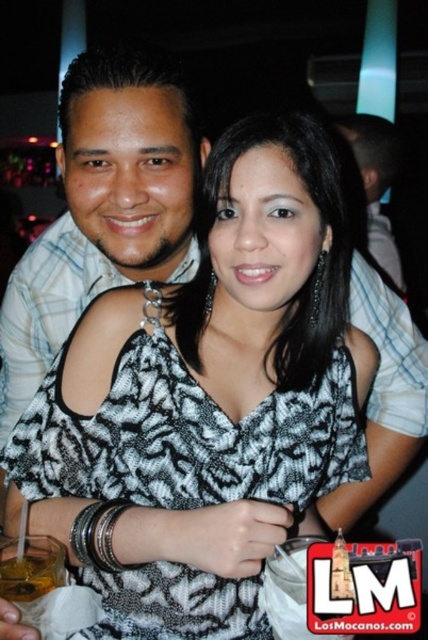
You are at a party and want to grab the translucent plastic cup at lower left to take a drink. However, the black printed fabric dress at center is blocking your path. Can you reach the cup without moving the dress?

The translucent plastic cup at lower left is behind the black printed fabric dress at center, so you can reach it without moving the dress since it is positioned behind.

You are at a party and want to take a photo of the black printed fabric dress at center. Where should you look to find it?

The black printed fabric dress at center is located at point (x=177, y=436).

You are at a party and need to identify the clothing items. Which clothing item is positioned to the left of the other between the black printed fabric dress at center and the matte black shirt at upper center?

The black printed fabric dress at center is positioned to the left of the matte black shirt at upper center.